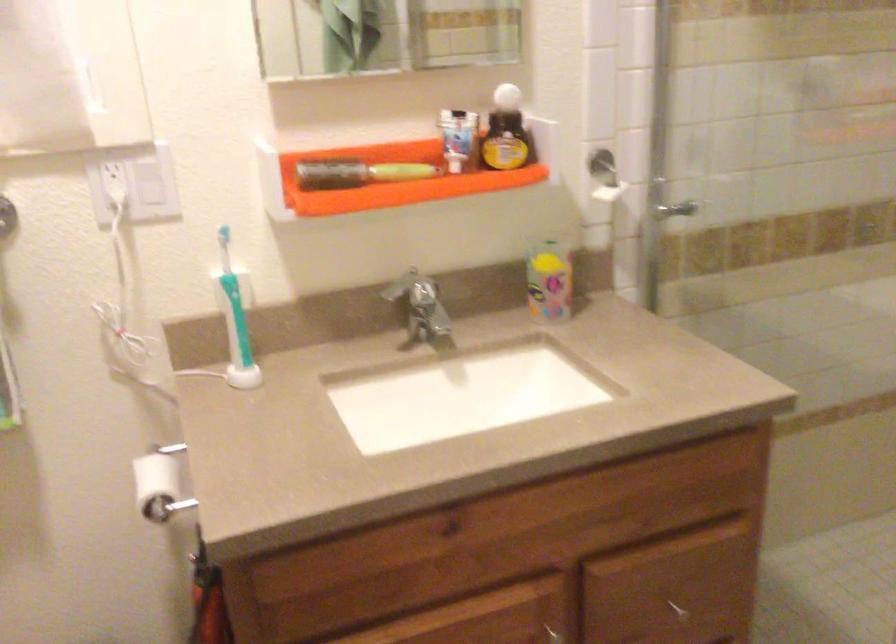
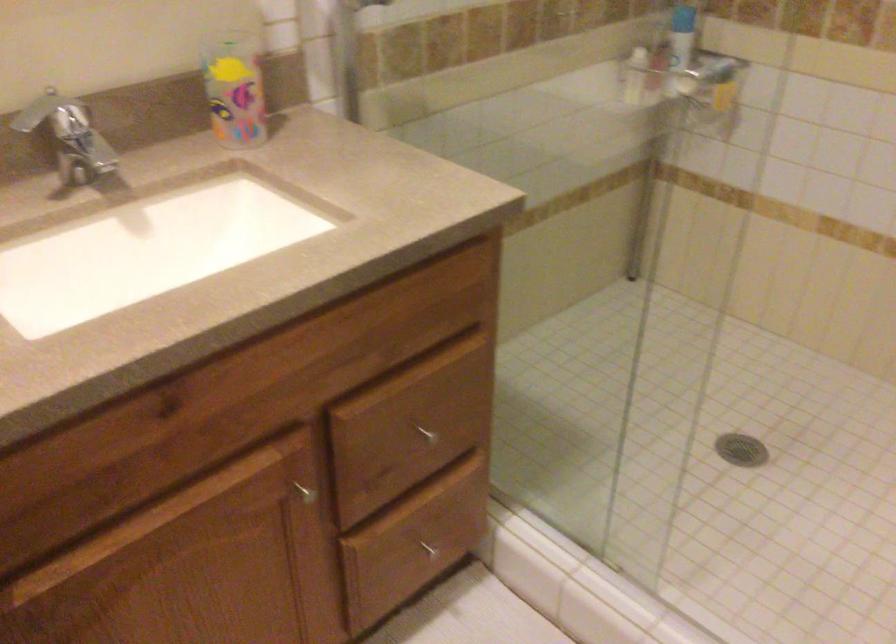
Question: The camera is either moving clockwise (left) or counter-clockwise (right) around the object. The first image is from the beginning of the video and the second image is from the end. Is the camera moving left or right when shooting the video?

Choices:
 (A) Left
 (B) Right

Answer: (A)